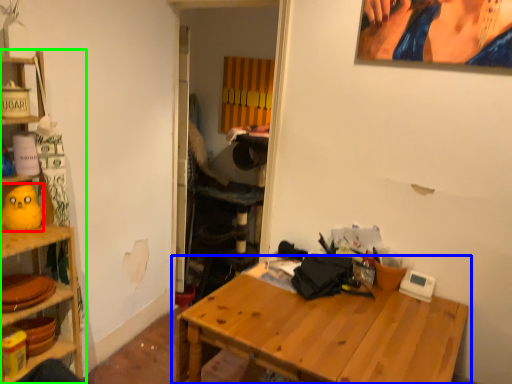
Question: Based on their relative distances, which object is nearer to toy (highlighted by a red box)? Choose from table (highlighted by a blue box) and shelf (highlighted by a green box).

Choices:
 (A) table
 (B) shelf

Answer: (B)